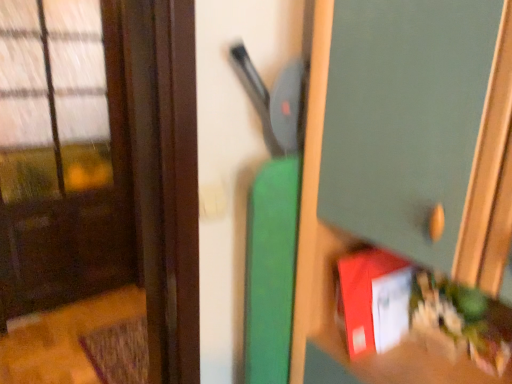
Question: Is brown matte door at left completely or partially inside red matte book at lower right, which is counted as the 2th book, starting from the left?

Choices:
 (A) no
 (B) yes

Answer: (A)

Question: Is red matte book at lower right, which is counted as the 2th book, starting from the left, to the right of brown matte door at left from the viewer's perspective?

Choices:
 (A) yes
 (B) no

Answer: (A)

Question: Is red matte book at lower right, which is counted as the 2th book, starting from the left, taller than brown matte door at left?

Choices:
 (A) no
 (B) yes

Answer: (A)

Question: From a real-world perspective, is red matte book at lower right, which is counted as the first book, starting from the right, positioned over brown matte door at left based on gravity?

Choices:
 (A) yes
 (B) no

Answer: (A)

Question: Is red matte book at lower right, which is counted as the 2th book, starting from the left, positioned before brown matte door at left?

Choices:
 (A) no
 (B) yes

Answer: (B)

Question: From a real-world perspective, is red matte book at lower right, which is counted as the 2th book, starting from the left, above or below green matte cabinet at center?

Choices:
 (A) above
 (B) below

Answer: (B)

Question: Would you say red matte book at lower right, which is counted as the 2th book, starting from the left, is to the left or to the right of green matte cabinet at center in the picture?

Choices:
 (A) left
 (B) right

Answer: (B)

Question: Is point (483, 321) positioned closer to the camera than point (501, 175)?

Choices:
 (A) closer
 (B) farther

Answer: (B)

Question: In terms of width, does red matte book at lower right, which is counted as the first book, starting from the right, look wider or thinner when compared to green matte cabinet at center?

Choices:
 (A) thin
 (B) wide

Answer: (A)

Question: Considering their positions, is red matte book at lower right, which is counted as the first book, starting from the right, located in front of or behind matte red book at lower right, the 1th book positioned from the left?

Choices:
 (A) behind
 (B) front

Answer: (B)

Question: From the image's perspective, is red matte book at lower right, which is counted as the 2th book, starting from the left, positioned above or below matte red book at lower right, the 1th book positioned from the left?

Choices:
 (A) below
 (B) above

Answer: (A)

Question: In terms of width, does red matte book at lower right, which is counted as the 2th book, starting from the left, look wider or thinner when compared to matte red book at lower right, the 1th book positioned from the left?

Choices:
 (A) wide
 (B) thin

Answer: (A)

Question: Is red matte book at lower right, which is counted as the 2th book, starting from the left, inside the boundaries of matte red book at lower right, the 2th book positioned from the right, or outside?

Choices:
 (A) outside
 (B) inside

Answer: (A)

Question: Does point (3, 89) appear closer or farther from the camera than point (385, 334)?

Choices:
 (A) farther
 (B) closer

Answer: (A)

Question: From a real-world perspective, is brown matte door at left positioned above or below matte red book at lower right, the 2th book positioned from the right?

Choices:
 (A) below
 (B) above

Answer: (A)